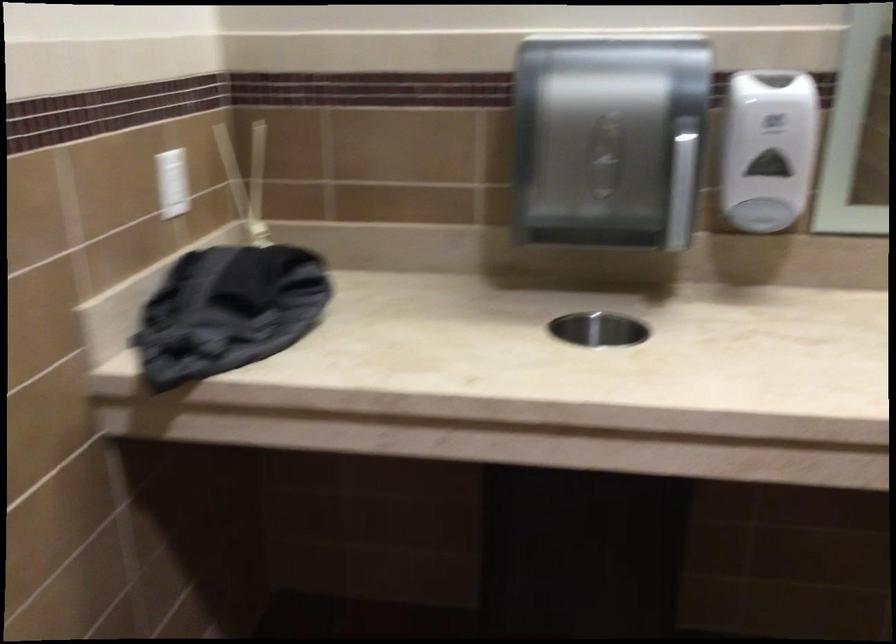
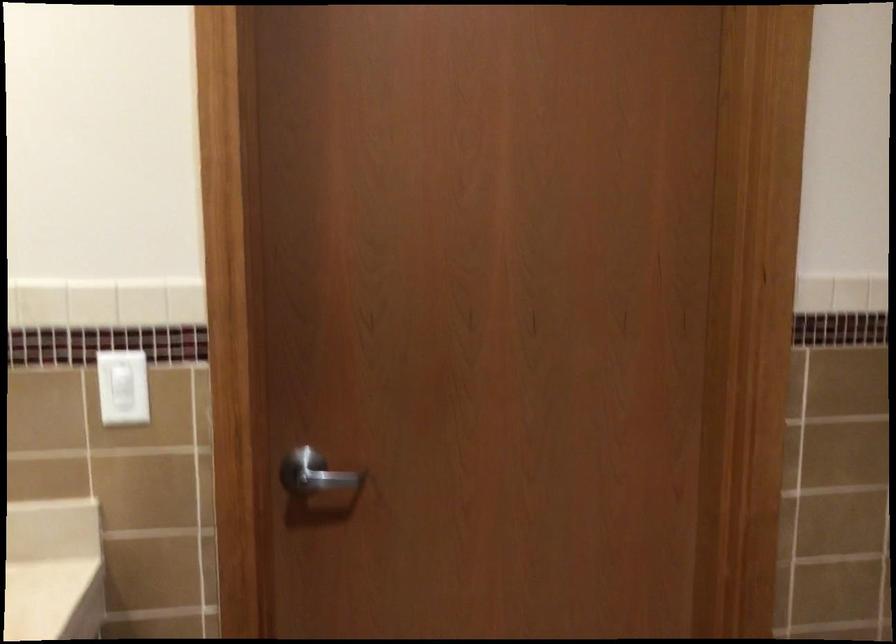
Question: Based on the continuous images, in which direction is the camera rotating? Reply with the corresponding letter.

Choices:
 (A) Left
 (B) Right
 (C) Up
 (D) Down

Answer: (B)